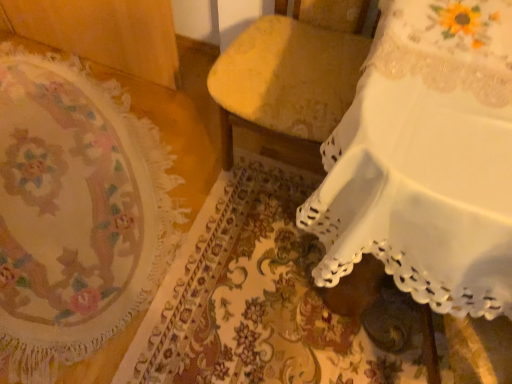
Locate an element on the screen. The height and width of the screenshot is (384, 512). vacant area on top of floral tapestry at left (from a real-world perspective) is located at coordinates (70, 163).